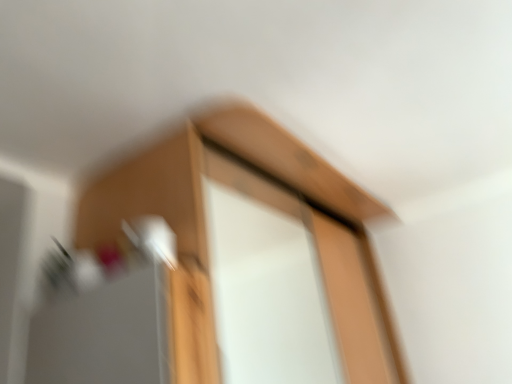
Measure the distance between point (166,187) and camera.

Point (166,187) and camera are 4.49 feet apart.

The image size is (512, 384). Describe the element at coordinates (269, 206) in the screenshot. I see `wooden dresser at center` at that location.

Locate an element on the screen. This screenshot has width=512, height=384. wooden dresser at center is located at coordinates (269, 206).

Where is `wooden dresser at center`? This screenshot has height=384, width=512. wooden dresser at center is located at coordinates (269, 206).